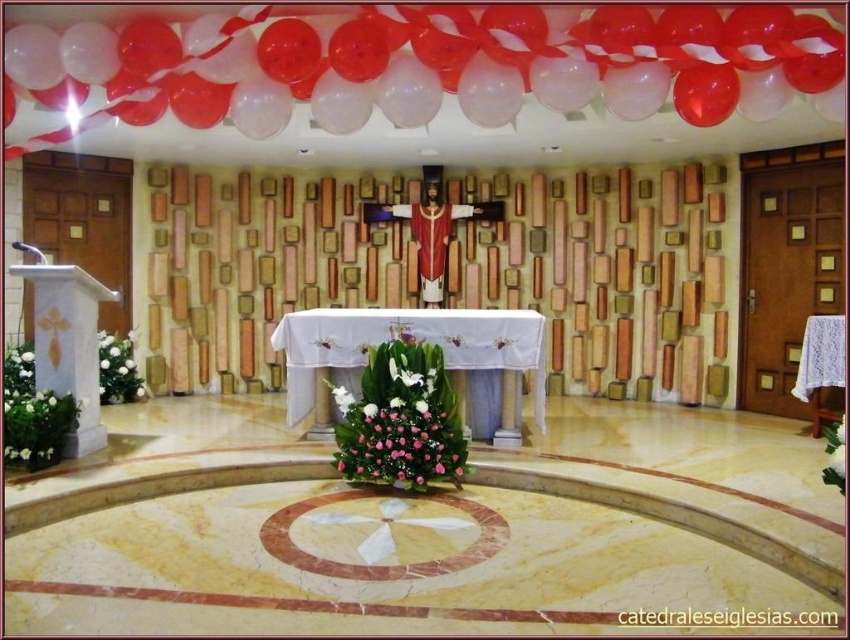
Question: Which of the following is the farthest from the observer?

Choices:
 (A) pink floral arrangement at center
 (B) transparent plastic balloon at upper center

Answer: (A)

Question: Which point is closer to the camera?

Choices:
 (A) pos(533,323)
 (B) pos(122,392)

Answer: (A)

Question: Which of these objects is positioned closest to the white embroidered cloth at center?

Choices:
 (A) shiny red fabric crucifix at center
 (B) white floral arrangement at left
 (C) pink floral arrangement at center

Answer: (C)

Question: Does transparent plastic balloon at upper center have a larger size compared to white floral arrangement at left?

Choices:
 (A) yes
 (B) no

Answer: (A)

Question: Can you confirm if pink floral arrangement at center is thinner than shiny red fabric crucifix at center?

Choices:
 (A) no
 (B) yes

Answer: (B)

Question: In this image, where is transparent plastic balloon at upper center located relative to white embroidered cloth at center?

Choices:
 (A) right
 (B) left

Answer: (A)